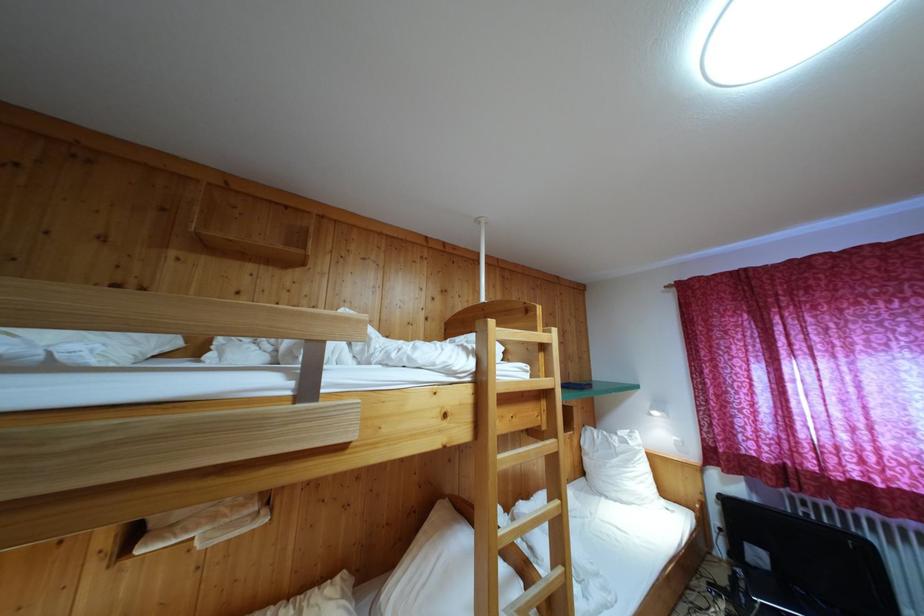
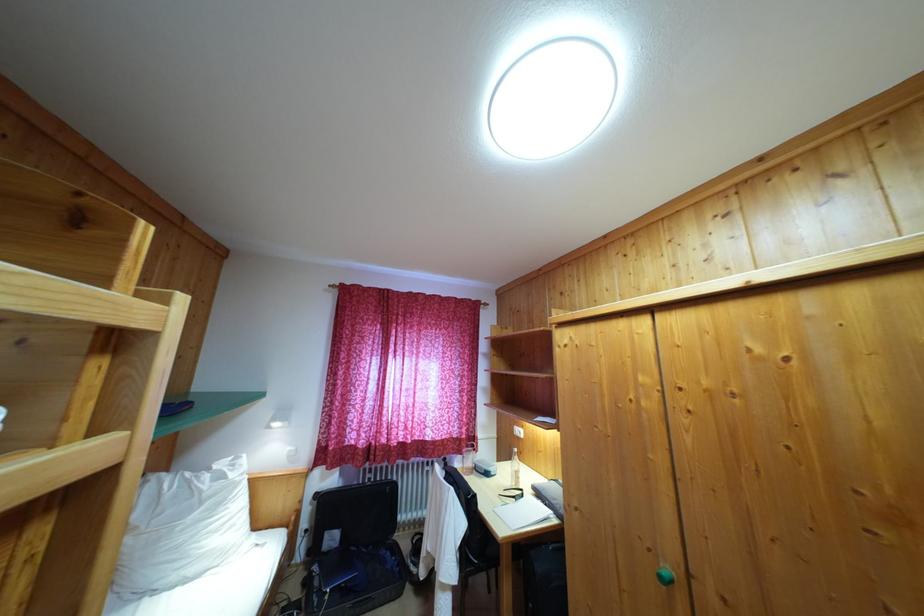
In the second image, find the point that corresponds to (x=619, y=440) in the first image.

(213, 476)